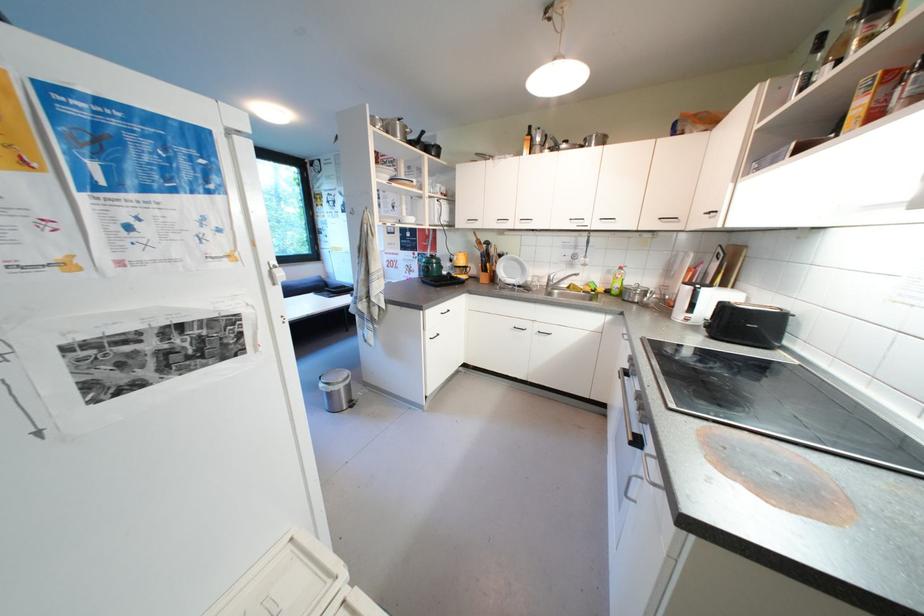
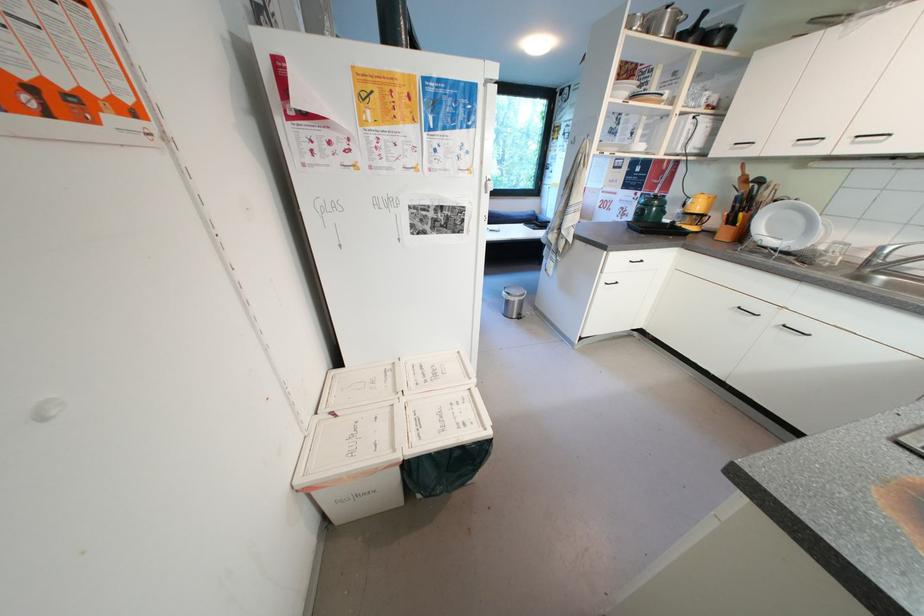
Locate, in the second image, the point that corresponds to [501,281] in the first image.

(749, 238)